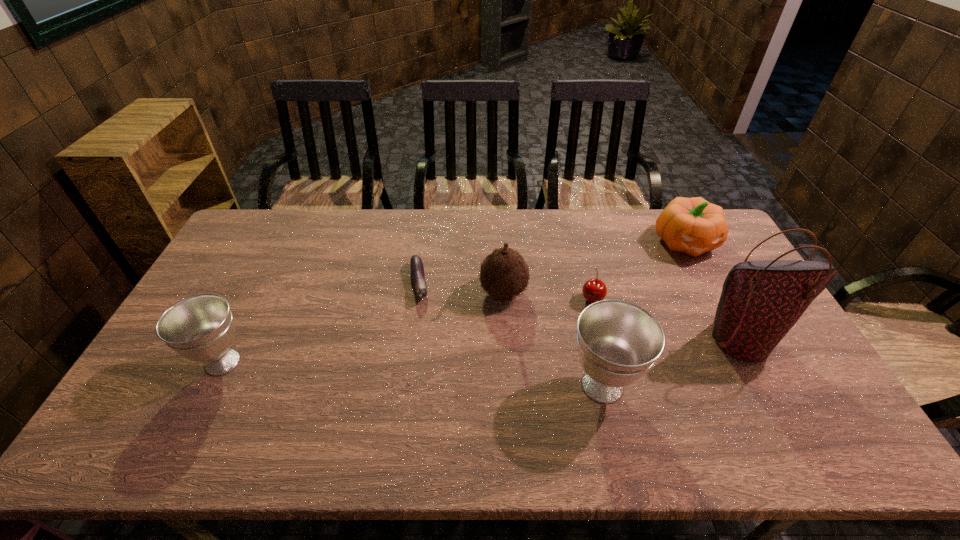
You are a GUI agent. You are given a task and a screenshot of the screen. Output one action in this format:
    pyautogui.click(x=<x>, y=<y>)
    Task: Click on the unoccupied area between the fifth object from right to left and the pumpkin
    This screenshot has width=960, height=540.
    Given the screenshot: What is the action you would take?
    pyautogui.click(x=594, y=267)

This screenshot has width=960, height=540. In order to click on vacant space that's between the leftmost object and the fifth object from right to left in this screenshot , I will do `click(363, 327)`.

The height and width of the screenshot is (540, 960). What are the coordinates of `vacant space that's between the right chalice and the leftmost object` in the screenshot? It's located at (413, 374).

Locate an element on the screen. The height and width of the screenshot is (540, 960). vacant area that lies between the cherry and the coconut is located at coordinates click(x=547, y=295).

The image size is (960, 540). I want to click on free space between the pumpkin and the second object from left to right, so click(x=552, y=263).

This screenshot has width=960, height=540. I want to click on vacant point located between the taller chalice and the tallest object, so click(672, 362).

The height and width of the screenshot is (540, 960). Identify the location of unoccupied position between the cherry and the coconut. (547, 295).

This screenshot has height=540, width=960. I want to click on free point between the shorter chalice and the pumpkin, so click(454, 302).

The width and height of the screenshot is (960, 540). I want to click on object that is the closest to the coconut, so click(x=416, y=265).

Identify the location of object that is the sixth closest one to the pumpkin. (200, 328).